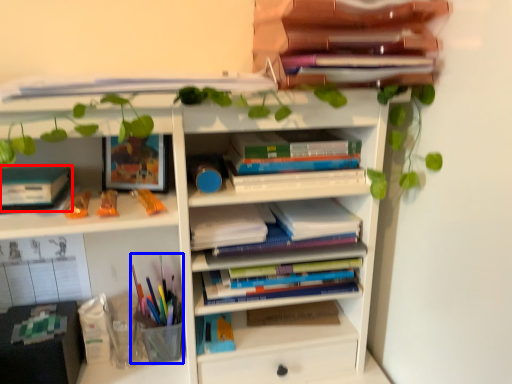
Question: Which point is further to the camera, paperback book (highlighted by a red box) or stationery (highlighted by a blue box)?

Choices:
 (A) paperback book
 (B) stationery

Answer: (B)